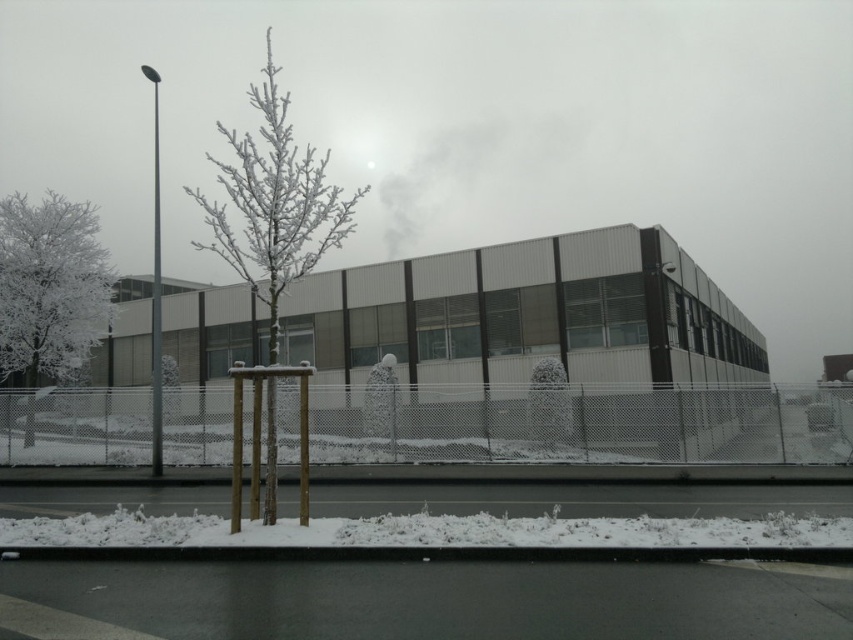
From the picture: You are a delivery person trying to see if the white frosted tree at left is visible from the road behind the wire mesh fence at lower center. Based on their heights, can the tree be seen over the fence?

The wire mesh fence at lower center is not as tall as white frosted tree at left, so yes, the white frosted tree at left can be seen over the wire mesh fence at lower center because the tree is taller than the fence.

You are a delivery person trying to navigate through the snow in the image. You see the wire mesh fence at lower center and the white frosted tree at left. Which one has a smaller width?

The wire mesh fence at lower center has a smaller width than the white frosted tree at left.